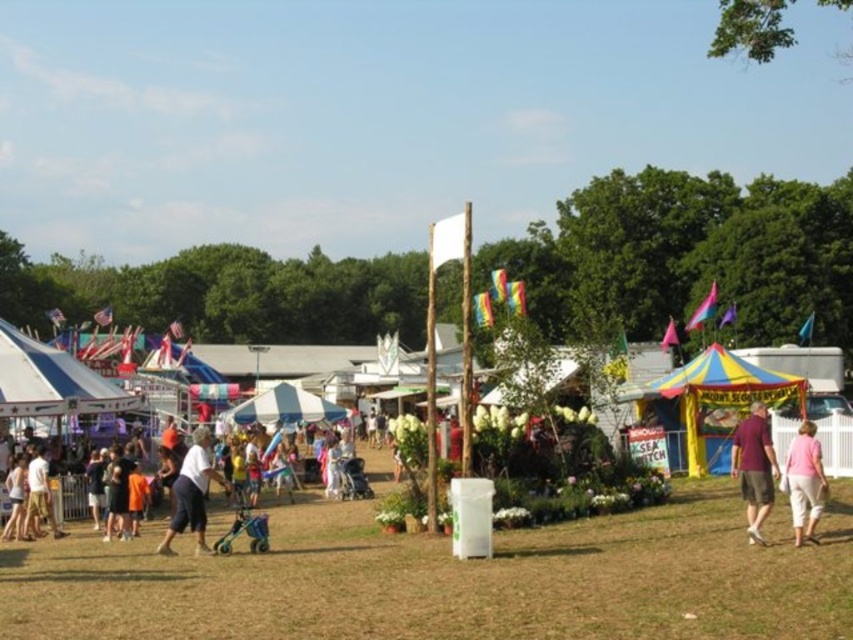
You are standing at the position of the camera and want to walk towards the point at the bottom right of the image. Which of the two points, point (749, 540) or point (299, 406), is closer to your starting position?

Point (749, 540) is closer to the camera than point (299, 406), so you would reach point (749, 540) first.